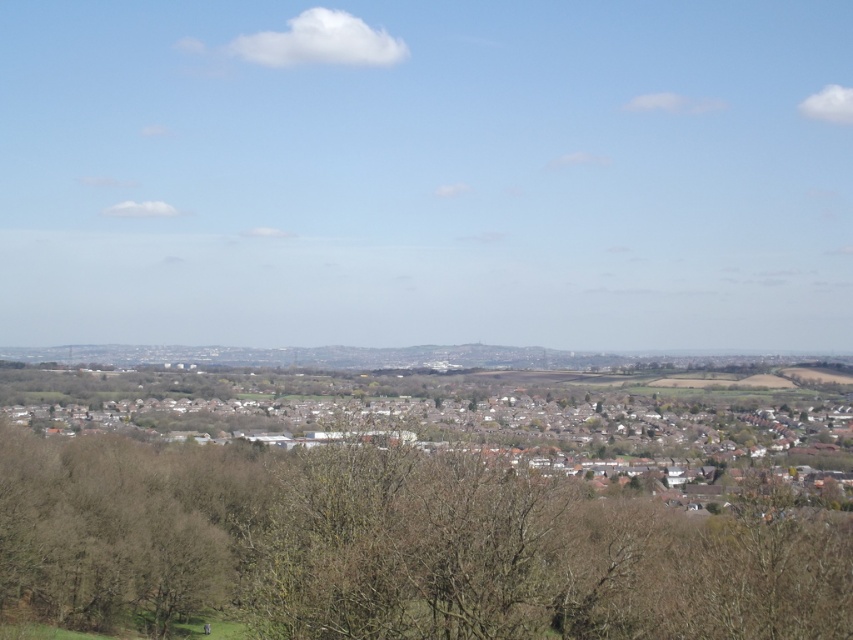
Question: Can you confirm if brown leafless tree at lower center is positioned below brown wooden houses at center?

Choices:
 (A) yes
 (B) no

Answer: (A)

Question: Does brown leafless tree at lower center appear under brown wooden houses at center?

Choices:
 (A) yes
 (B) no

Answer: (A)

Question: Does brown leafless tree at lower center have a greater width compared to brown wooden houses at center?

Choices:
 (A) yes
 (B) no

Answer: (B)